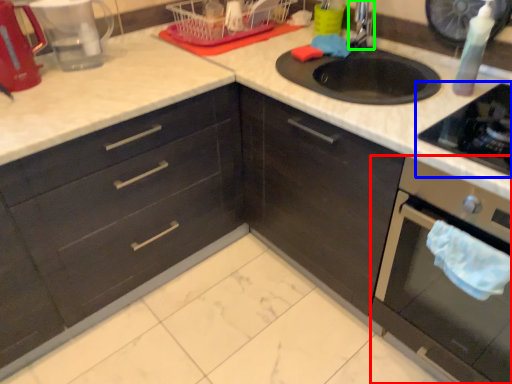
Question: Considering the real-world distances, which object is farthest from oven (highlighted by a red box)? gas stove (highlighted by a blue box) or faucet (highlighted by a green box)?

Choices:
 (A) gas stove
 (B) faucet

Answer: (B)